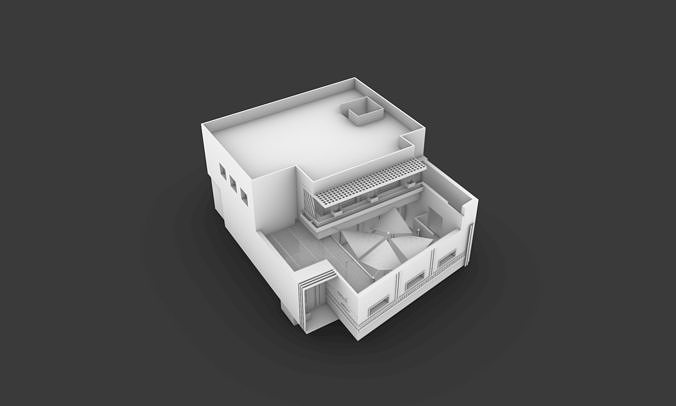
Locate an element on the screen. Image resolution: width=676 pixels, height=406 pixels. house plan is located at coordinates (285, 251).